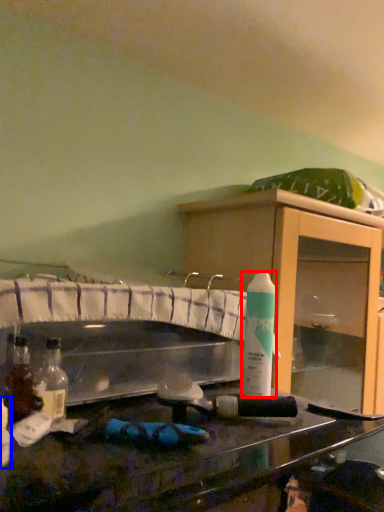
Question: Which point is further to the camera, cleaning product (highlighted by a red box) or bottle (highlighted by a blue box)?

Choices:
 (A) cleaning product
 (B) bottle

Answer: (A)